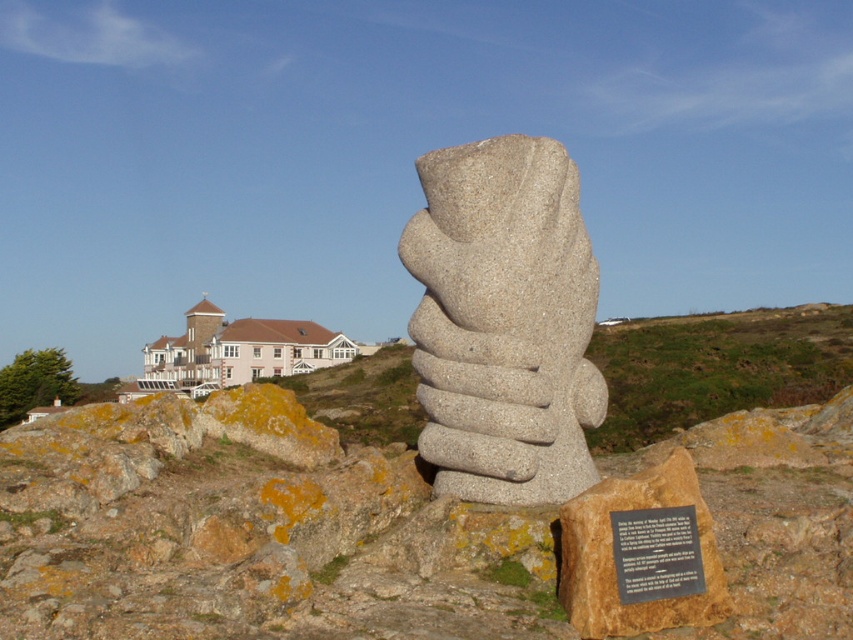
Who is shorter, gray granite sculpture at center or black paper at center?

Standing shorter between the two is black paper at center.

Which is in front, point (537, 220) or point (618, 577)?

Point (618, 577) is in front.

Describe the element at coordinates (503, 321) in the screenshot. The height and width of the screenshot is (640, 853). I see `gray granite sculpture at center` at that location.

You are a GUI agent. You are given a task and a screenshot of the screen. Output one action in this format:
    pyautogui.click(x=<x>, y=<y>)
    Task: Click on the gray granite sculpture at center
    The width and height of the screenshot is (853, 640).
    Given the screenshot: What is the action you would take?
    pyautogui.click(x=503, y=321)

At what (x,y) coordinates should I click in order to perform the action: click on brown rock at center. Please return your answer as a coordinate pair (x, y). Looking at the image, I should click on (257, 522).

Is brown rock at center to the right of gray granite sculpture at center from the viewer's perspective?

Correct, you'll find brown rock at center to the right of gray granite sculpture at center.

This screenshot has height=640, width=853. What do you see at coordinates (257, 522) in the screenshot? I see `brown rock at center` at bounding box center [257, 522].

The width and height of the screenshot is (853, 640). I want to click on brown rock at center, so click(x=257, y=522).

Is point (206, 502) positioned before point (698, 577)?

No.

Looking at this image, does brown rock at center appear on the left side of black paper at center?

Incorrect, brown rock at center is not on the left side of black paper at center.

Is point (144, 488) positioned before point (622, 512)?

No, (144, 488) is behind (622, 512).

You are a GUI agent. You are given a task and a screenshot of the screen. Output one action in this format:
    pyautogui.click(x=<x>, y=<y>)
    Task: Click on the brown rock at center
    Image resolution: width=853 pixels, height=640 pixels.
    Given the screenshot: What is the action you would take?
    pyautogui.click(x=257, y=522)